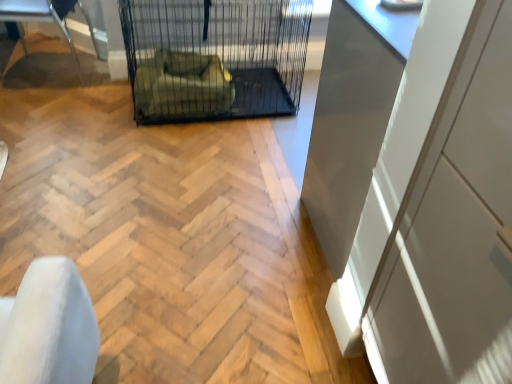
Question: From a real-world perspective, does black wire mesh cage at center stand above white glossy cabinet at right?

Choices:
 (A) yes
 (B) no

Answer: (B)

Question: Is white glossy cabinet at right surrounded by black wire mesh cage at center?

Choices:
 (A) no
 (B) yes

Answer: (A)

Question: Considering the relative positions of black wire mesh cage at center and white glossy cabinet at right in the image provided, is black wire mesh cage at center in front of white glossy cabinet at right?

Choices:
 (A) yes
 (B) no

Answer: (B)

Question: Is black wire mesh cage at center positioned far away from white glossy cabinet at right?

Choices:
 (A) no
 (B) yes

Answer: (B)

Question: From the image's perspective, is black wire mesh cage at center beneath white glossy cabinet at right?

Choices:
 (A) no
 (B) yes

Answer: (A)

Question: Could you tell me if black wire mesh cage at center is turned towards white glossy cabinet at right?

Choices:
 (A) yes
 (B) no

Answer: (A)

Question: Is metallic silver chair at left oriented towards black wire mesh cage at center?

Choices:
 (A) yes
 (B) no

Answer: (B)

Question: From the image's perspective, would you say metallic silver chair at left is shown under black wire mesh cage at center?

Choices:
 (A) no
 (B) yes

Answer: (A)

Question: From a real-world perspective, is metallic silver chair at left beneath black wire mesh cage at center?

Choices:
 (A) no
 (B) yes

Answer: (B)

Question: From the image's perspective, is metallic silver chair at left located above black wire mesh cage at center?

Choices:
 (A) yes
 (B) no

Answer: (A)

Question: Can you confirm if metallic silver chair at left is wider than black wire mesh cage at center?

Choices:
 (A) no
 (B) yes

Answer: (A)

Question: Can you confirm if metallic silver chair at left is positioned to the right of black wire mesh cage at center?

Choices:
 (A) no
 (B) yes

Answer: (A)

Question: Can you confirm if green fabric armchair at center is positioned to the left of metallic silver chair at left?

Choices:
 (A) no
 (B) yes

Answer: (A)